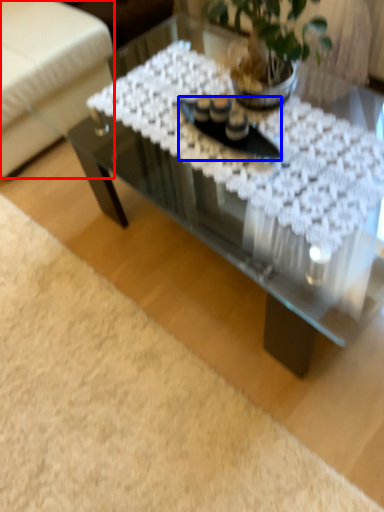
Question: Which object is further to the camera taking this photo, armchair (highlighted by a red box) or glass plate (highlighted by a blue box)?

Choices:
 (A) armchair
 (B) glass plate

Answer: (A)